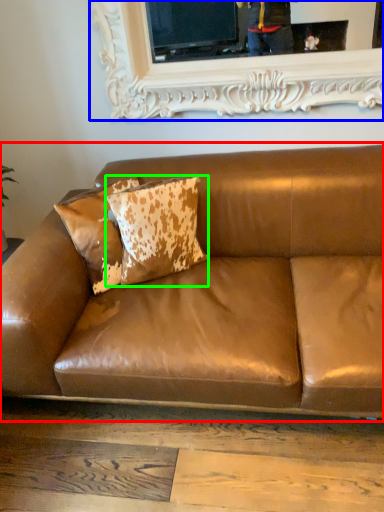
Question: Based on their relative distances, which object is nearer to studio couch (highlighted by a red box)? Choose from picture frame (highlighted by a blue box) and pillow (highlighted by a green box).

Choices:
 (A) picture frame
 (B) pillow

Answer: (B)